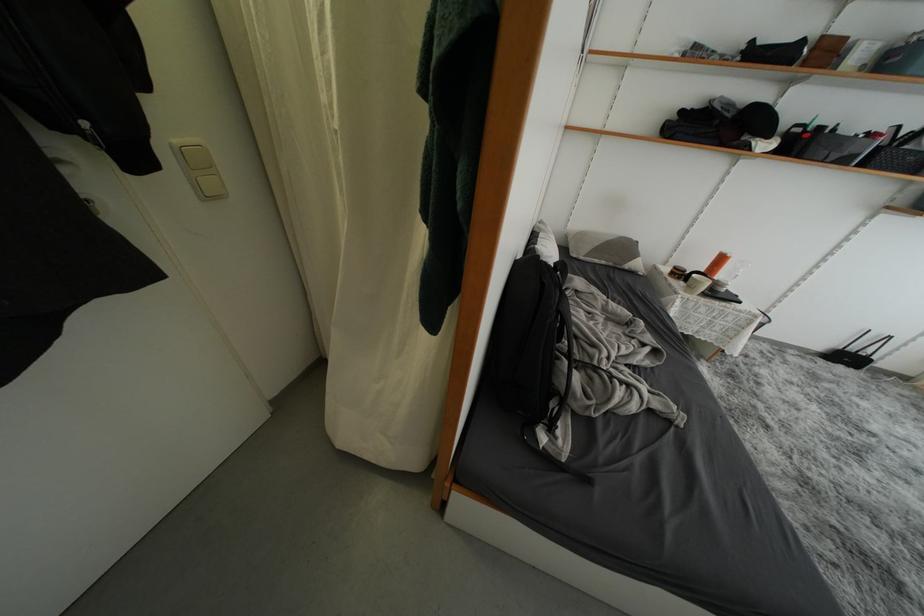
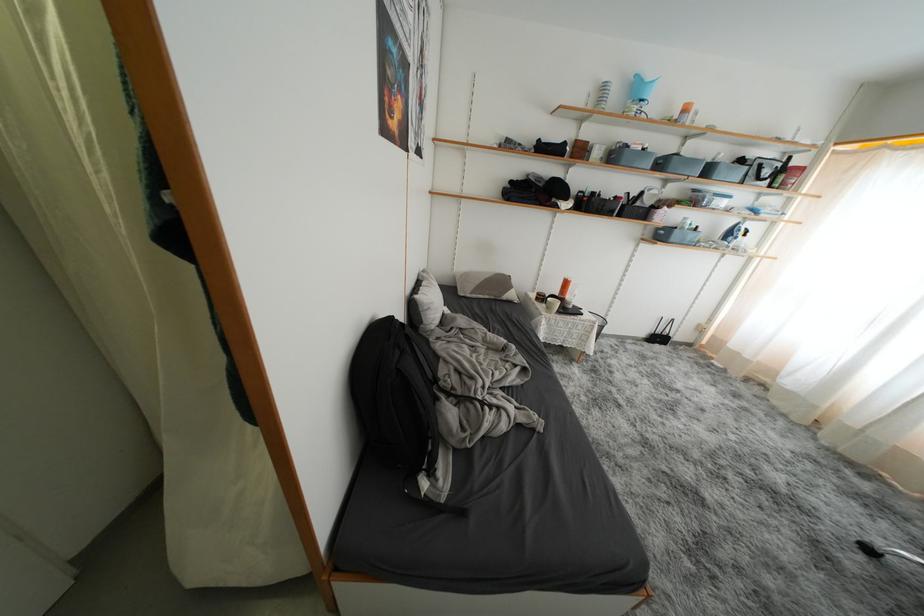
Locate, in the second image, the point that corresponds to [631,252] in the first image.

(508, 286)